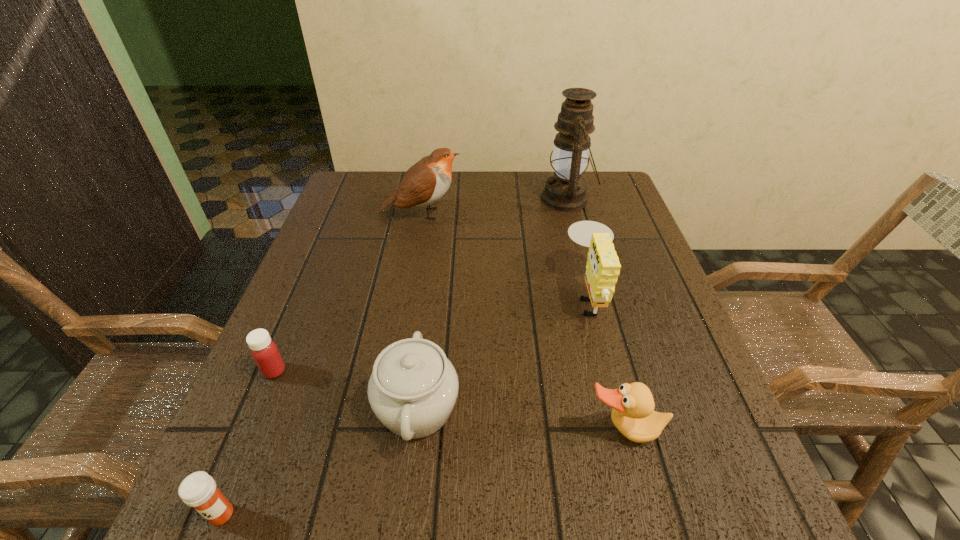
Where is `empty space that is in between the chinaware and the tallest object`? This screenshot has height=540, width=960. empty space that is in between the chinaware and the tallest object is located at coordinates (492, 303).

Locate an element on the screen. This screenshot has width=960, height=540. the third closest object to the oil lamp is located at coordinates (413, 388).

Where is `object that ranks as the third closest to the bird`? The image size is (960, 540). object that ranks as the third closest to the bird is located at coordinates (413, 388).

The height and width of the screenshot is (540, 960). I want to click on vacant space that satisfies the following two spatial constraints: 1. on the front side of the chinaware; 2. on the right side of the farther medicine, so click(258, 408).

The height and width of the screenshot is (540, 960). I want to click on vacant space that satisfies the following two spatial constraints: 1. at the face of the bird; 2. on the front side of the farther medicine, so click(394, 371).

Locate an element on the screen. The height and width of the screenshot is (540, 960). vacant region that satisfies the following two spatial constraints: 1. on the front-facing side of the sponge; 2. on the label side of the nearest object is located at coordinates (646, 514).